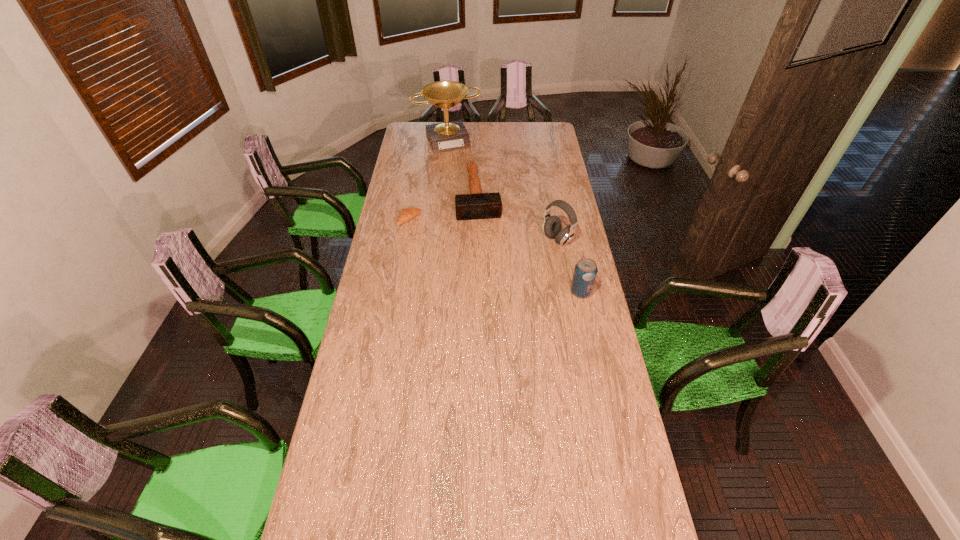
Image resolution: width=960 pixels, height=540 pixels. Find the location of `vacant space located on the ear cups of the fourth shortest object`. vacant space located on the ear cups of the fourth shortest object is located at coordinates point(488,278).

Locate an element on the screen. blank space located 0.360m on the ear cups of the fourth shortest object is located at coordinates (482, 281).

This screenshot has width=960, height=540. What are the coordinates of `vacant space situated on the ear cups of the fourth shortest object` in the screenshot? It's located at (516, 263).

What are the coordinates of `free location located on the front-facing side of the farthest object` in the screenshot? It's located at (470, 181).

This screenshot has height=540, width=960. Find the location of `free point located 0.380m on the front-facing side of the farthest object`. free point located 0.380m on the front-facing side of the farthest object is located at coordinates (474, 190).

You are a GUI agent. You are given a task and a screenshot of the screen. Output one action in this format:
    pyautogui.click(x=<x>, y=<y>)
    Task: Click on the vacant point located on the front-facing side of the farthest object
    The width and height of the screenshot is (960, 540).
    Given the screenshot: What is the action you would take?
    pyautogui.click(x=465, y=171)

The width and height of the screenshot is (960, 540). I want to click on blank space located 0.250m on the striking face of the mallet, so click(486, 256).

Where is `vacant area situated 0.180m on the striking face of the mallet`? vacant area situated 0.180m on the striking face of the mallet is located at coordinates (484, 246).

In order to click on free space located on the striking face of the mallet in this screenshot , I will do `click(484, 245)`.

Where is `object at the far edge`? The width and height of the screenshot is (960, 540). object at the far edge is located at coordinates (448, 136).